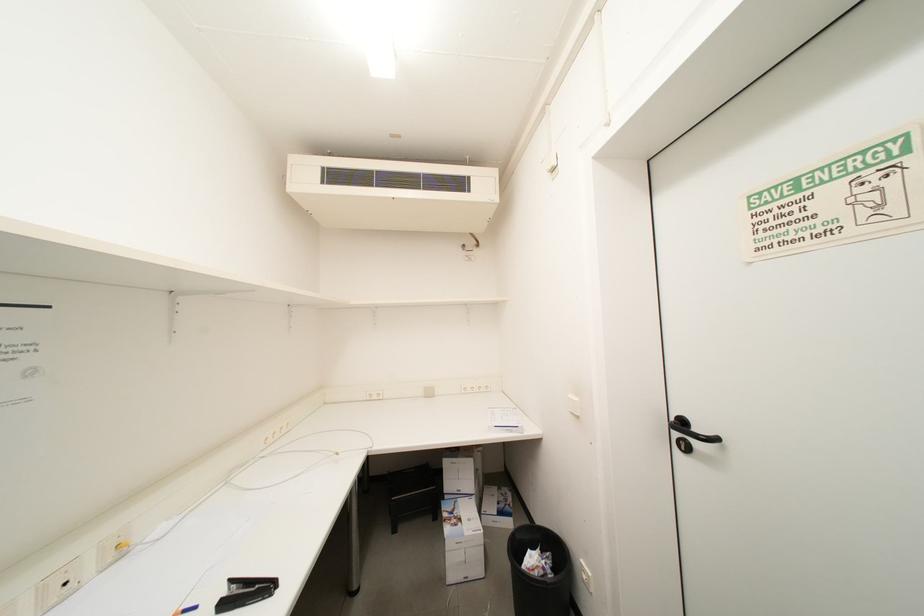
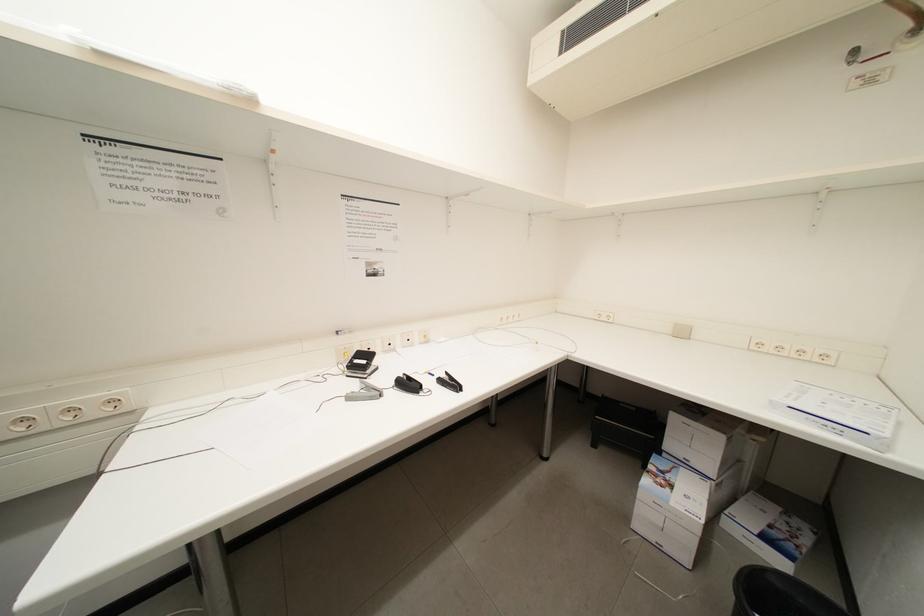
The first image is from the beginning of the video and the second image is from the end. How did the camera likely rotate when shooting the video?

The camera's rotation is toward left-down.